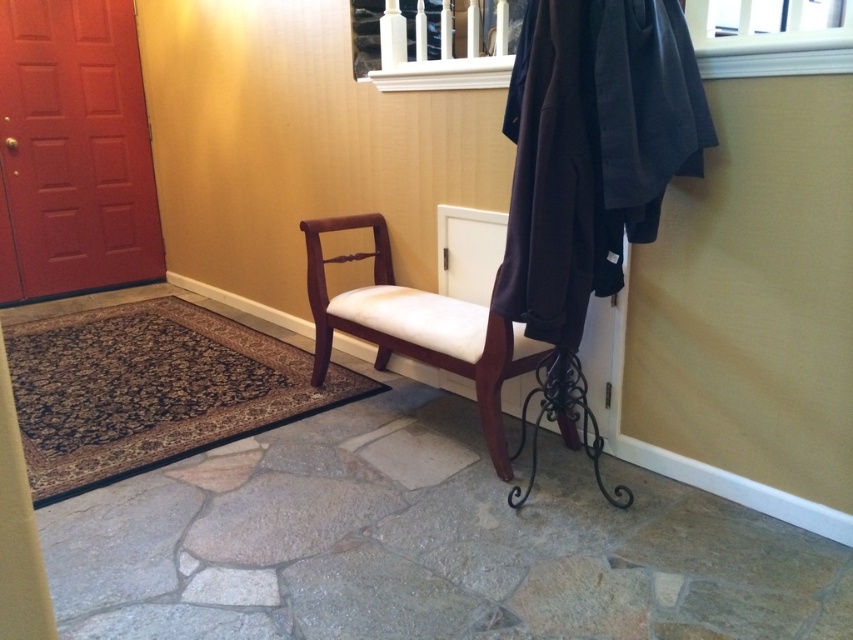
You are organizing a small gathering and need to place a 50 cm wide decorative tray between the dark woolen robe at upper right and the mahogany wood chair at center. Can the tray fit in the space between them?

The dark woolen robe at upper right is 52.10 centimeters from the mahogany wood chair at center, so yes, the 50 cm wide decorative tray can fit between them as the distance is slightly larger than the tray.

You are standing in the entryway and want to place a small potted plant between the two points labeled point (566, 45) and point (334, 259). Which point should the plant be closer to in order to be positioned in front of the other point?

The plant should be closer to point (566, 45) because it is in front of point (334, 259).